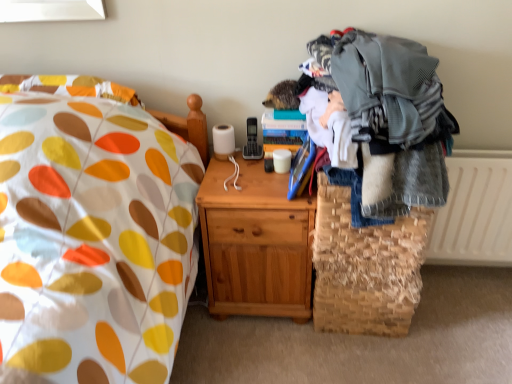
Question: Is woven straw basket at lower right taller or shorter than gray knitted sweater at right?

Choices:
 (A) tall
 (B) short

Answer: (B)

Question: Is woven straw basket at lower right to the left or to the right of gray knitted sweater at right in the image?

Choices:
 (A) right
 (B) left

Answer: (A)

Question: Which is farther from the gray knitted sweater at right?

Choices:
 (A) woven straw basket at lower right
 (B) light brown wood nightstand at center
 (C) white textured radiator at right

Answer: (C)

Question: Based on their relative distances, which object is nearer to the white textured radiator at right?

Choices:
 (A) light brown wood nightstand at center
 (B) gray knitted sweater at right
 (C) woven straw basket at lower right

Answer: (C)